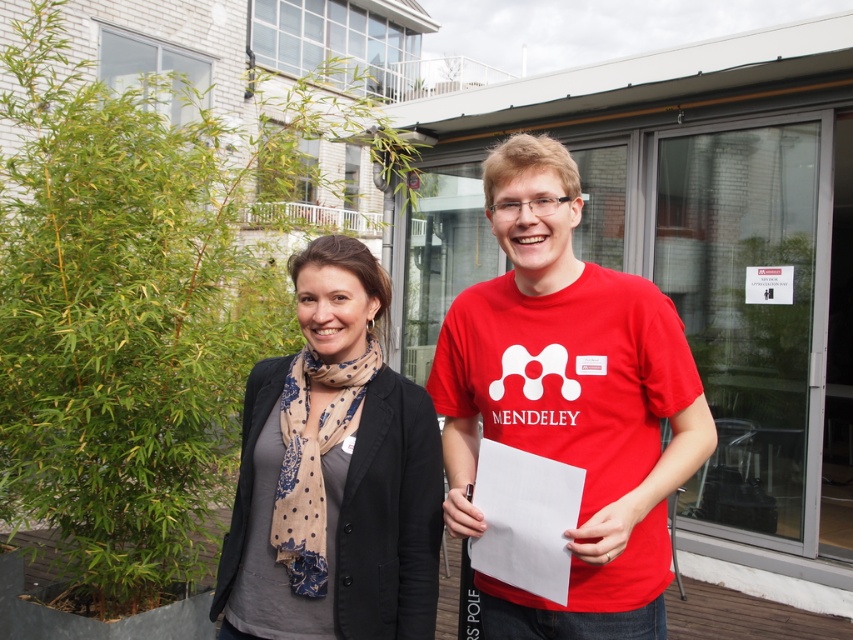
Is red matte t-shirt at center bigger than matte black blazer at center?

Indeed, red matte t-shirt at center has a larger size compared to matte black blazer at center.

Where is `red matte t-shirt at center`? The height and width of the screenshot is (640, 853). red matte t-shirt at center is located at coordinates (569, 401).

Which is in front, point (659, 636) or point (430, 406)?

Point (659, 636) is more forward.

Identify the location of red matte t-shirt at center. (569, 401).